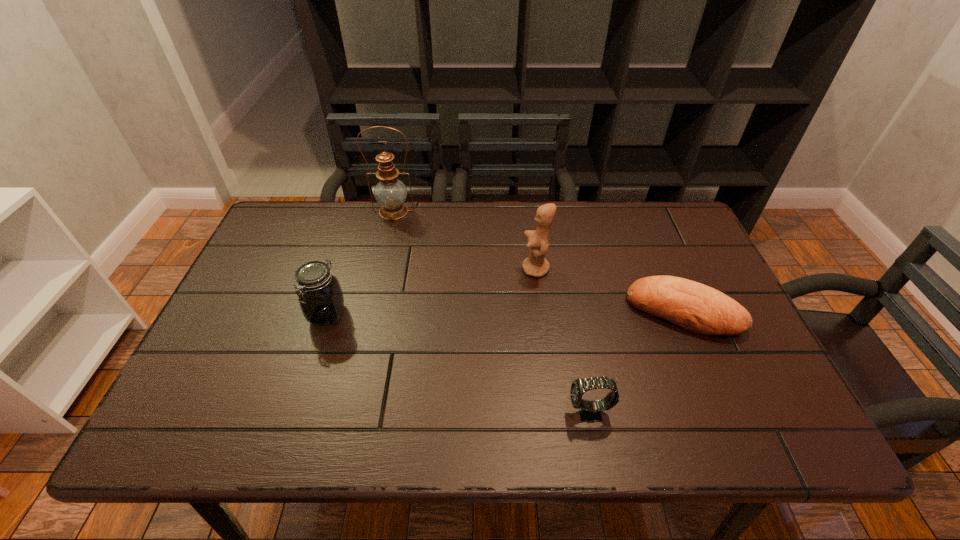
Find the location of a particular element. This screenshot has width=960, height=540. object positioned at the right edge is located at coordinates (693, 306).

Where is `free space at the far edge of the desktop`? Image resolution: width=960 pixels, height=540 pixels. free space at the far edge of the desktop is located at coordinates (483, 237).

In the image, there is a desktop. At what (x,y) coordinates should I click in order to perform the action: click on vacant space at the near edge. Please return your answer as a coordinate pair (x, y). Looking at the image, I should click on (456, 429).

At what (x,y) coordinates should I click in order to perform the action: click on free space at the right edge of the desktop. Please return your answer as a coordinate pair (x, y). Looking at the image, I should click on (773, 377).

Locate an element on the screen. The height and width of the screenshot is (540, 960). vacant space at the near left corner of the desktop is located at coordinates (233, 409).

Locate an element on the screen. This screenshot has width=960, height=540. blank space at the far right corner of the desktop is located at coordinates (667, 233).

The image size is (960, 540). In the image, there is a desktop. In order to click on vacant space at the near right corner in this screenshot , I will do `click(773, 425)`.

You are a GUI agent. You are given a task and a screenshot of the screen. Output one action in this format:
    pyautogui.click(x=<x>, y=<y>)
    Task: Click on the vacant area that lies between the bread and the figurine
    Image resolution: width=960 pixels, height=540 pixels.
    Given the screenshot: What is the action you would take?
    pyautogui.click(x=610, y=291)

Locate an element on the screen. This screenshot has height=540, width=960. empty space between the nearest object and the jar is located at coordinates (458, 363).

Where is `vacant space in between the third tallest object and the second tallest object`? vacant space in between the third tallest object and the second tallest object is located at coordinates (432, 292).